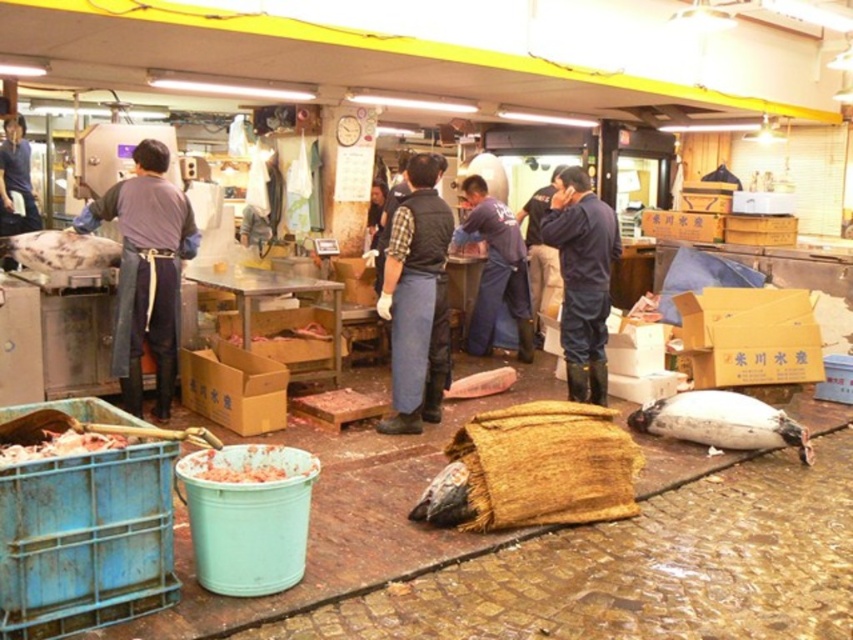
Question: Which of the following is the farthest from the observer?

Choices:
 (A) (561, 301)
 (B) (247, 460)

Answer: (A)

Question: Which of the following is the farthest from the observer?

Choices:
 (A) (122, 440)
 (B) (491, 252)

Answer: (B)

Question: Can you confirm if white matte fish at lower right is wider than white shredded meat at lower left?

Choices:
 (A) no
 (B) yes

Answer: (B)

Question: Considering the real-world distances, which object is farthest from the white matte fish at lower right?

Choices:
 (A) white textured fish at center
 (B) dark blue apron at left
 (C) meat paste at lower left
 (D) brown cardboard box at center

Answer: (A)

Question: Does white textured fish at center have a larger size compared to dark blue fabric at center?

Choices:
 (A) yes
 (B) no

Answer: (B)

Question: Can you confirm if dark blue apron at left is positioned above dark blue fabric at center?

Choices:
 (A) yes
 (B) no

Answer: (B)